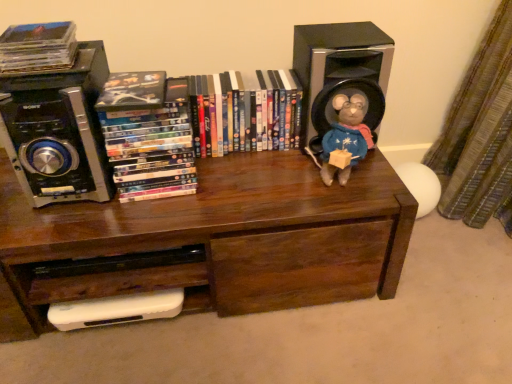
Find the location of a particular element. This screenshot has width=512, height=384. black plastic speaker at upper right, arranged as the second speaker when viewed from the left is located at coordinates (336, 67).

The width and height of the screenshot is (512, 384). Find the location of `matte black compact disc at upper left, the 3th book positioned from the right`. matte black compact disc at upper left, the 3th book positioned from the right is located at coordinates (38, 47).

Measure the distance between point [359,133] and camera.

They are 3.45 feet apart.

The height and width of the screenshot is (384, 512). What are the coordinates of `matte plastic dvds at left, positioned as the 2th book in right-to-left order` in the screenshot? It's located at (148, 135).

From the image's perspective, is matte plastic dvds at center, marked as the first book in a right-to-left arrangement, above or below brown wood bookcase at center?

Based on their image positions, matte plastic dvds at center, marked as the first book in a right-to-left arrangement, is located above brown wood bookcase at center.

Could you tell me if matte plastic dvds at center, which ranks as the 3th book in left-to-right order, is turned towards brown wood bookcase at center?

No, matte plastic dvds at center, which ranks as the 3th book in left-to-right order, is not oriented towards brown wood bookcase at center.

Considering the relative sizes of matte plastic dvds at center, which ranks as the 3th book in left-to-right order, and brown wood bookcase at center in the image provided, is matte plastic dvds at center, which ranks as the 3th book in left-to-right order, smaller than brown wood bookcase at center?

Indeed, matte plastic dvds at center, which ranks as the 3th book in left-to-right order, has a smaller size compared to brown wood bookcase at center.

Is matte plastic dvds at center, marked as the first book in a right-to-left arrangement, wider or thinner than brown wood bookcase at center?

Considering their sizes, matte plastic dvds at center, marked as the first book in a right-to-left arrangement, looks slimmer than brown wood bookcase at center.

Considering the sizes of black plastic speaker at upper right, which is counted as the first speaker, starting from the right, and fuzzy fabric stuffed animal at upper right in the image, is black plastic speaker at upper right, which is counted as the first speaker, starting from the right, bigger or smaller than fuzzy fabric stuffed animal at upper right?

Clearly, black plastic speaker at upper right, which is counted as the first speaker, starting from the right, is larger in size than fuzzy fabric stuffed animal at upper right.

From a real-world perspective, between black plastic speaker at upper right, arranged as the second speaker when viewed from the left, and fuzzy fabric stuffed animal at upper right, who is vertically lower?

fuzzy fabric stuffed animal at upper right.

Is black plastic speaker at upper right, arranged as the second speaker when viewed from the left, shorter than fuzzy fabric stuffed animal at upper right?

No, black plastic speaker at upper right, arranged as the second speaker when viewed from the left, is not shorter than fuzzy fabric stuffed animal at upper right.

In the scene shown: Are black plastic speaker at upper right, arranged as the second speaker when viewed from the left, and fuzzy fabric stuffed animal at upper right far apart?

No, black plastic speaker at upper right, arranged as the second speaker when viewed from the left, is not far away from fuzzy fabric stuffed animal at upper right.

Is fuzzy fabric stuffed animal at upper right to the right of matte black compact disc at upper left, the 1th book when ordered from left to right, from the viewer's perspective?

Indeed, fuzzy fabric stuffed animal at upper right is positioned on the right side of matte black compact disc at upper left, the 1th book when ordered from left to right.

From the image's perspective, is fuzzy fabric stuffed animal at upper right positioned above or below matte black compact disc at upper left, the 3th book positioned from the right?

fuzzy fabric stuffed animal at upper right is situated lower than matte black compact disc at upper left, the 3th book positioned from the right, in the image.

From a real-world perspective, is fuzzy fabric stuffed animal at upper right above or below matte black compact disc at upper left, the 3th book positioned from the right?

Clearly, from a real-world perspective, fuzzy fabric stuffed animal at upper right is below matte black compact disc at upper left, the 3th book positioned from the right.

Is fuzzy fabric stuffed animal at upper right facing towards matte black compact disc at upper left, the 3th book positioned from the right?

No, fuzzy fabric stuffed animal at upper right does not turn towards matte black compact disc at upper left, the 3th book positioned from the right.

Considering the sizes of objects black plastic speaker at upper left, arranged as the first speaker when viewed from the left, and brown wood bookcase at center in the image provided, who is shorter, black plastic speaker at upper left, arranged as the first speaker when viewed from the left, or brown wood bookcase at center?

black plastic speaker at upper left, arranged as the first speaker when viewed from the left, is shorter.

Which is in front, black plastic speaker at upper left, which ranks as the 2th speaker in right-to-left order, or brown wood bookcase at center?

black plastic speaker at upper left, which ranks as the 2th speaker in right-to-left order, is in front.

Considering the sizes of objects matte plastic dvds at left, positioned as the second book in left-to-right order, and matte plastic dvds at center, marked as the first book in a right-to-left arrangement, in the image provided, who is wider, matte plastic dvds at left, positioned as the second book in left-to-right order, or matte plastic dvds at center, marked as the first book in a right-to-left arrangement,?

matte plastic dvds at left, positioned as the second book in left-to-right order, is wider.

How many degrees apart are the facing directions of matte plastic dvds at left, positioned as the second book in left-to-right order, and matte plastic dvds at center, which ranks as the 3th book in left-to-right order?

matte plastic dvds at left, positioned as the second book in left-to-right order, and matte plastic dvds at center, which ranks as the 3th book in left-to-right order, are facing 3.64 degrees away from each other.

Does point (155, 144) come in front of point (225, 102)?

Yes, it is in front of point (225, 102).

Does matte plastic dvds at left, positioned as the second book in left-to-right order, turn towards matte plastic dvds at center, which ranks as the 3th book in left-to-right order?

No, matte plastic dvds at left, positioned as the second book in left-to-right order, is not oriented towards matte plastic dvds at center, which ranks as the 3th book in left-to-right order.

From the image's perspective, is brown wood bookcase at center over black plastic speaker at upper left, which ranks as the 2th speaker in right-to-left order?

No, from the image's perspective, brown wood bookcase at center is not above black plastic speaker at upper left, which ranks as the 2th speaker in right-to-left order.

Between brown wood bookcase at center and black plastic speaker at upper left, which ranks as the 2th speaker in right-to-left order, which one has less height?

black plastic speaker at upper left, which ranks as the 2th speaker in right-to-left order.

Between brown wood bookcase at center and black plastic speaker at upper left, which ranks as the 2th speaker in right-to-left order, which one has larger size?

With larger size is brown wood bookcase at center.

Choose the correct answer: Is matte plastic dvds at center, marked as the first book in a right-to-left arrangement, inside fuzzy fabric stuffed animal at upper right or outside it?

matte plastic dvds at center, marked as the first book in a right-to-left arrangement, is outside fuzzy fabric stuffed animal at upper right.

Considering the relative positions of matte plastic dvds at center, which ranks as the 3th book in left-to-right order, and fuzzy fabric stuffed animal at upper right in the image provided, is matte plastic dvds at center, which ranks as the 3th book in left-to-right order, to the left or to the right of fuzzy fabric stuffed animal at upper right?

In the image, matte plastic dvds at center, which ranks as the 3th book in left-to-right order, appears on the left side of fuzzy fabric stuffed animal at upper right.

How distant is matte plastic dvds at center, marked as the first book in a right-to-left arrangement, from fuzzy fabric stuffed animal at upper right?

matte plastic dvds at center, marked as the first book in a right-to-left arrangement, is 8.23 inches from fuzzy fabric stuffed animal at upper right.

Is point (240, 136) closer or farther from the camera than point (322, 141)?

Point (240, 136) is farther from the camera than point (322, 141).

At what (x,y) coordinates should I click in order to perform the action: click on book that appears behind the brown wood bookcase at center. Please return your answer as a coordinate pair (x, y). This screenshot has height=384, width=512. Looking at the image, I should click on (247, 112).

The width and height of the screenshot is (512, 384). I want to click on toy lying below the black plastic speaker at upper right, arranged as the second speaker when viewed from the left (from the image's perspective), so coord(346,136).

Considering their positions, is black plastic speaker at upper right, arranged as the second speaker when viewed from the left, positioned further to white plastic drawer at lower left than matte plastic dvds at left, positioned as the second book in left-to-right order?

The object further to white plastic drawer at lower left is black plastic speaker at upper right, arranged as the second speaker when viewed from the left.

When comparing their distances from black plastic speaker at upper left, arranged as the first speaker when viewed from the left, does matte plastic dvds at left, positioned as the 2th book in right-to-left order, or white plastic drawer at lower left seem closer?

Based on the image, matte plastic dvds at left, positioned as the 2th book in right-to-left order, appears to be nearer to black plastic speaker at upper left, arranged as the first speaker when viewed from the left.

When comparing their distances from fuzzy fabric stuffed animal at upper right, does black plastic speaker at upper right, arranged as the second speaker when viewed from the left, or matte plastic dvds at center, which ranks as the 3th book in left-to-right order, seem closer?

black plastic speaker at upper right, arranged as the second speaker when viewed from the left, lies closer to fuzzy fabric stuffed animal at upper right than the other object.

Looking at the image, which one is located further to brown wood bookcase at center, black plastic speaker at upper right, arranged as the second speaker when viewed from the left, or fuzzy fabric stuffed animal at upper right?

Based on the image, black plastic speaker at upper right, arranged as the second speaker when viewed from the left, appears to be further to brown wood bookcase at center.

From the image, which object appears to be farther from matte plastic dvds at center, marked as the first book in a right-to-left arrangement, fuzzy fabric stuffed animal at upper right or white plastic drawer at lower left?

white plastic drawer at lower left.

Based on their spatial positions, is matte plastic dvds at left, positioned as the second book in left-to-right order, or black plastic speaker at upper left, arranged as the first speaker when viewed from the left, further from matte black compact disc at upper left, the 3th book positioned from the right?

matte plastic dvds at left, positioned as the second book in left-to-right order, is positioned further to the anchor matte black compact disc at upper left, the 3th book positioned from the right.

Estimate the real-world distances between objects in this image. Which object is closer to matte plastic dvds at center, which ranks as the 3th book in left-to-right order, matte plastic dvds at left, positioned as the second book in left-to-right order, or fuzzy fabric stuffed animal at upper right?

matte plastic dvds at left, positioned as the second book in left-to-right order, is closer to matte plastic dvds at center, which ranks as the 3th book in left-to-right order.

Looking at the image, which one is located closer to matte plastic dvds at center, which ranks as the 3th book in left-to-right order, fuzzy fabric stuffed animal at upper right or black plastic speaker at upper right, arranged as the second speaker when viewed from the left?

Among the two, black plastic speaker at upper right, arranged as the second speaker when viewed from the left, is located nearer to matte plastic dvds at center, which ranks as the 3th book in left-to-right order.

This screenshot has height=384, width=512. Identify the location of toy between matte plastic dvds at center, which ranks as the 3th book in left-to-right order, and black plastic speaker at upper right, arranged as the second speaker when viewed from the left, in the horizontal direction. (346, 136).

Identify the location of toy between matte black compact disc at upper left, the 3th book positioned from the right, and black plastic speaker at upper right, arranged as the second speaker when viewed from the left, in the horizontal direction. (346, 136).

Image resolution: width=512 pixels, height=384 pixels. I want to click on toy between brown wood bookcase at center and black plastic speaker at upper right, which is counted as the first speaker, starting from the right, from left to right, so click(x=346, y=136).

The image size is (512, 384). What are the coordinates of `bookcase situated between black plastic speaker at upper left, which ranks as the 2th speaker in right-to-left order, and black plastic speaker at upper right, which is counted as the first speaker, starting from the right, from left to right` in the screenshot? It's located at (215, 240).